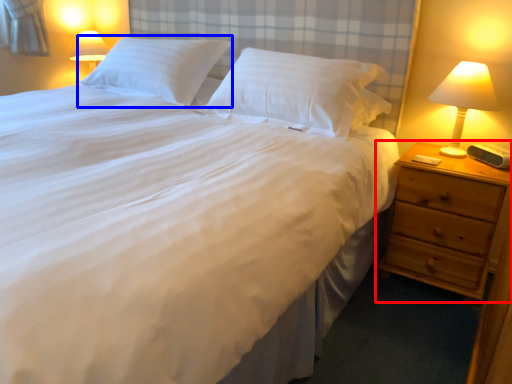
Question: Among these objects, which one is farthest to the camera, nightstand (highlighted by a red box) or pillow (highlighted by a blue box)?

Choices:
 (A) nightstand
 (B) pillow

Answer: (B)